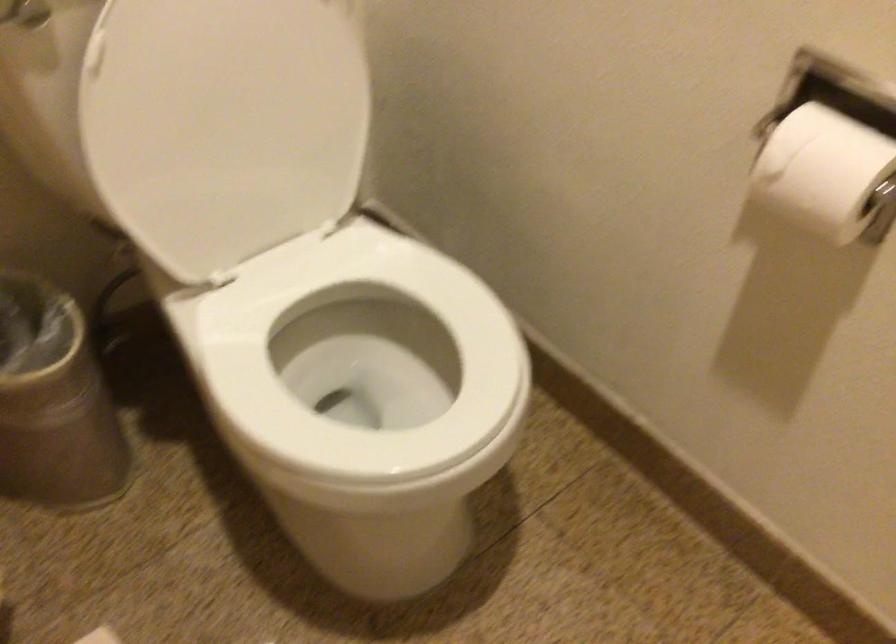
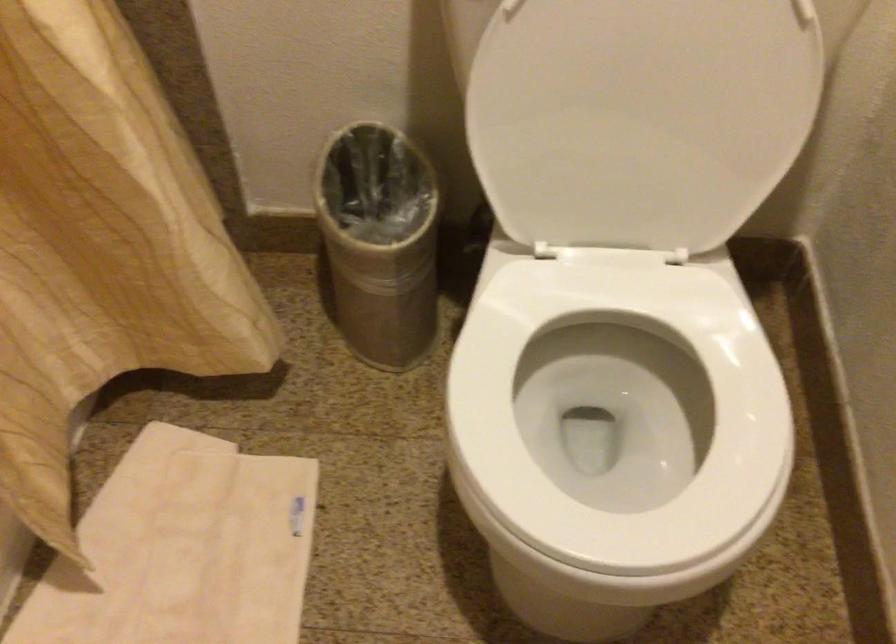
Find the pixel in the second image that matches pixel 248 127 in the first image.

(640, 118)